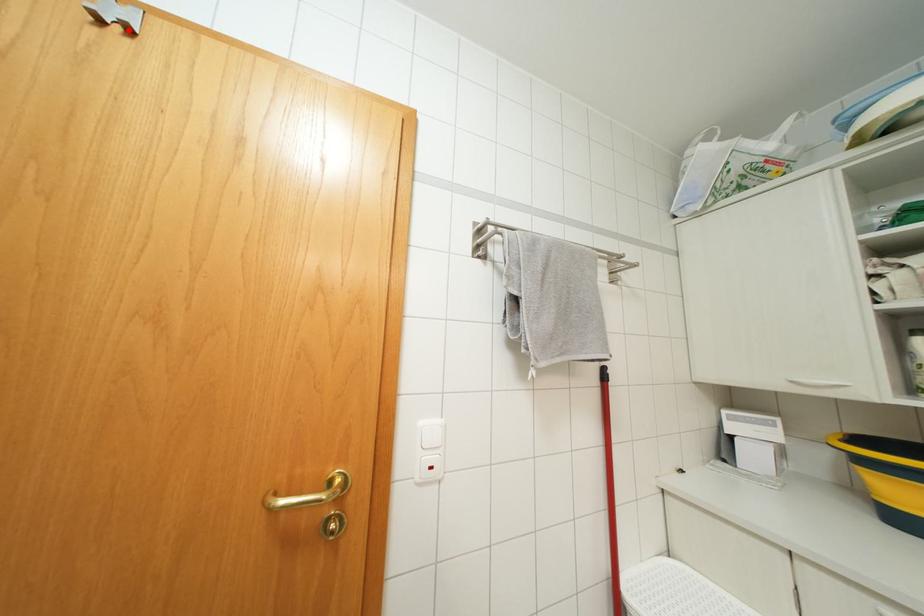
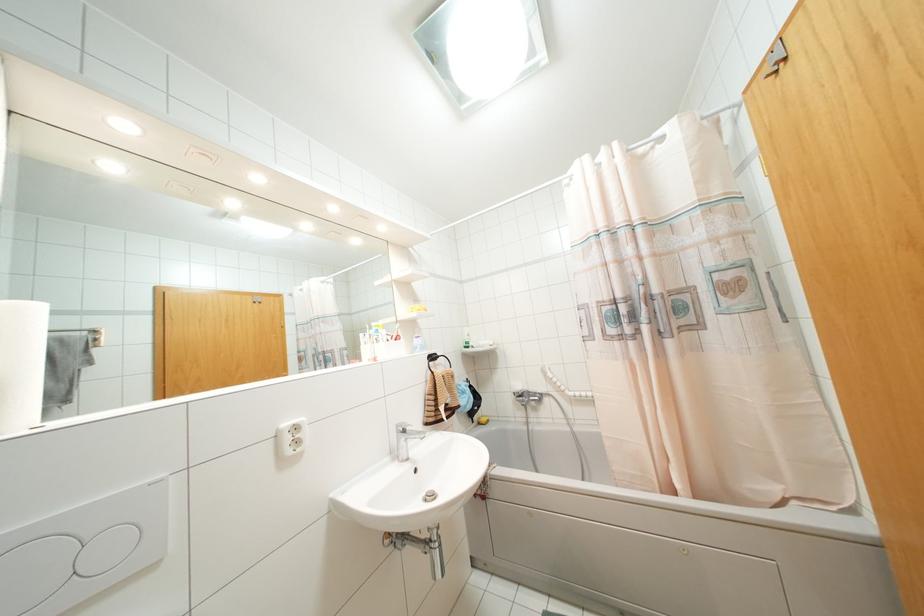
Find the pixel in the second image that matches the highlighted location in the first image.

(784, 58)